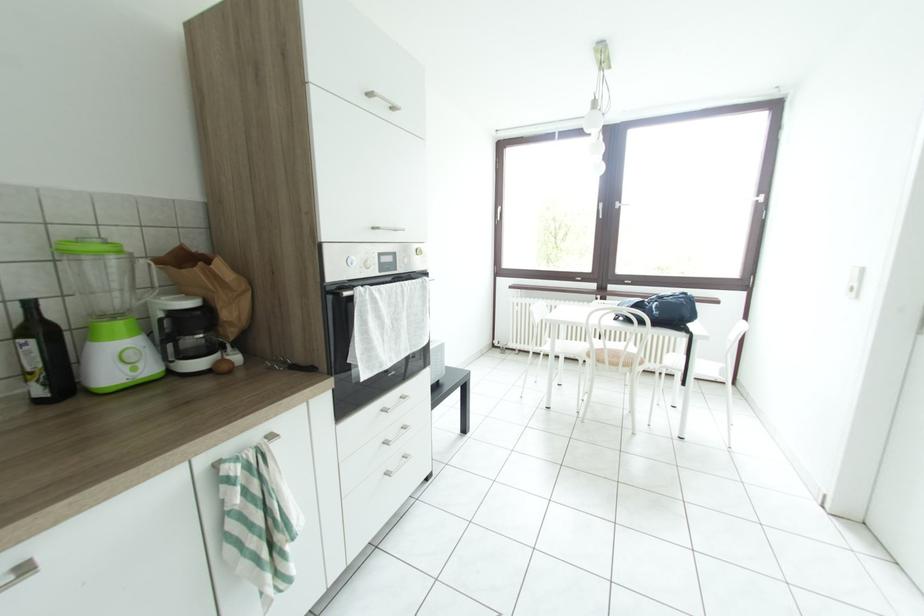
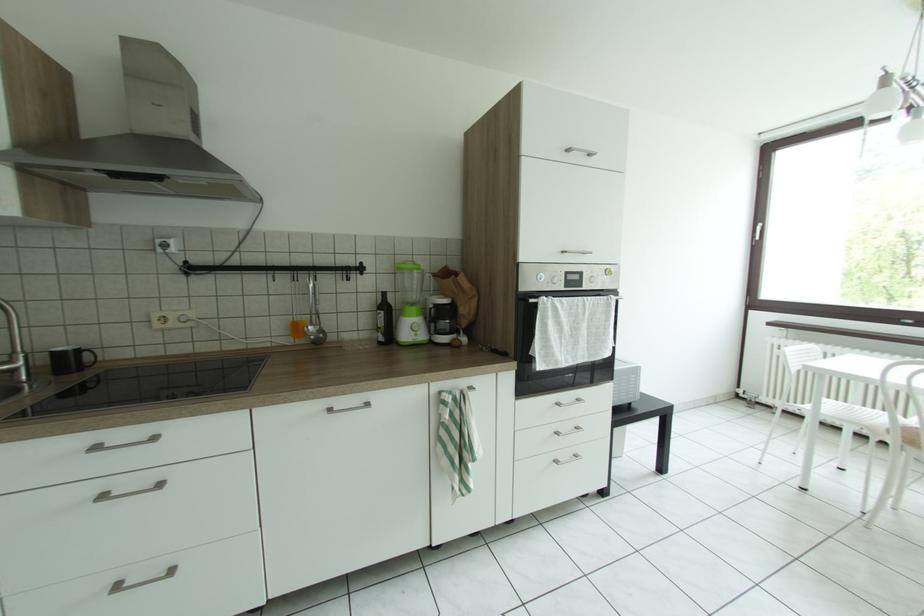
Question: The camera is either moving clockwise (left) or counter-clockwise (right) around the object. The first image is from the beginning of the video and the second image is from the end. Is the camera moving left or right when shooting the video?

Choices:
 (A) Left
 (B) Right

Answer: (B)